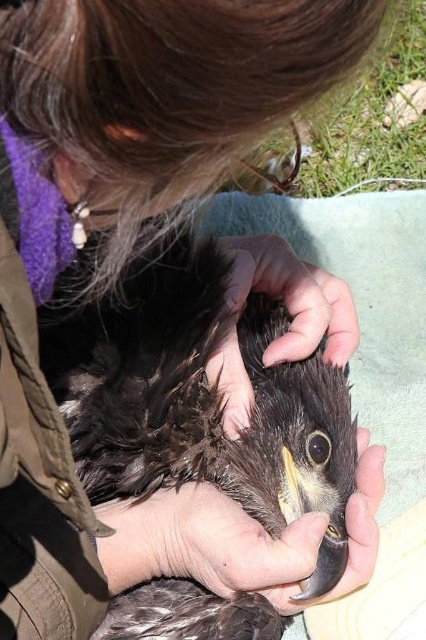
Question: Which point is farther to the camera?

Choices:
 (A) brown feathered hand at center
 (B) dark brown feathers at center

Answer: (A)

Question: Is dark brown feathers at center to the left of brown feathered hand at center from the viewer's perspective?

Choices:
 (A) yes
 (B) no

Answer: (A)

Question: Among these points, which one is nearest to the camera?

Choices:
 (A) (126, 436)
 (B) (239, 310)

Answer: (A)

Question: Is dark brown feathers at center in front of brown feathered hand at center?

Choices:
 (A) yes
 (B) no

Answer: (A)

Question: Is dark brown feathers at center above brown feathered hand at center?

Choices:
 (A) no
 (B) yes

Answer: (A)

Question: Which point is farther to the camera?

Choices:
 (A) brown feathered hand at center
 (B) dark brown feathers at center

Answer: (A)